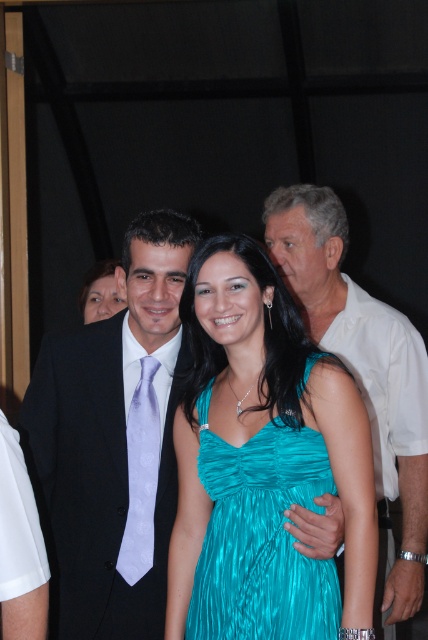
Question: Does black satin suit at center have a lesser width compared to lavender satin tie at center?

Choices:
 (A) no
 (B) yes

Answer: (A)

Question: Based on their relative distances, which object is farther from the black satin suit at center?

Choices:
 (A) white smooth shirt at upper right
 (B) teal satin dress at center
 (C) teal shiny dress at center
 (D) lavender satin tie at center

Answer: (A)

Question: Based on their relative distances, which object is nearer to the teal shiny dress at center?

Choices:
 (A) black satin suit at center
 (B) white smooth shirt at upper right
 (C) teal satin dress at center
 (D) lavender satin tie at center

Answer: (D)

Question: Does teal satin dress at center have a greater width compared to teal shiny dress at center?

Choices:
 (A) no
 (B) yes

Answer: (B)

Question: Is black satin suit at center smaller than white smooth shirt at upper right?

Choices:
 (A) yes
 (B) no

Answer: (A)

Question: Which of the following is the closest to the observer?

Choices:
 (A) (157, 468)
 (B) (356, 316)

Answer: (A)